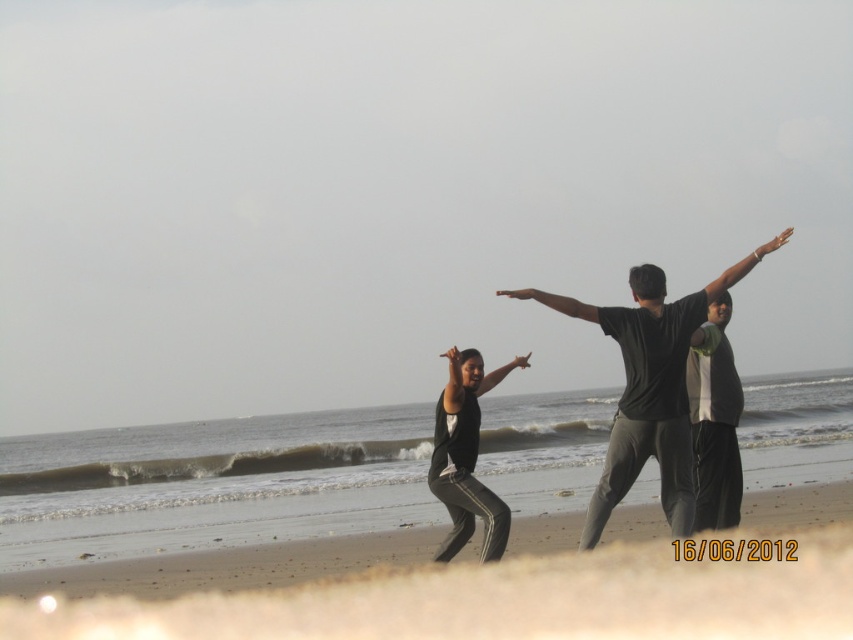
You are a photographer trying to capture a clear shot of the black matte shirt at center and the black matte pants at center. Since you want to focus on the shirt, which object should you adjust your camera to prioritize in terms of size in the frame?

The black matte shirt at center is bigger than the black matte pants at center, so you should prioritize focusing on the black matte shirt at center as it already occupies a larger portion of the frame.

You are standing on the beige sandy beach at lower center and looking towards the dark gray cotton shirt at right. Which object is lower in position?

The beige sandy beach at lower center is below the dark gray cotton shirt at right, so the beige sandy beach at lower center is lower in position.